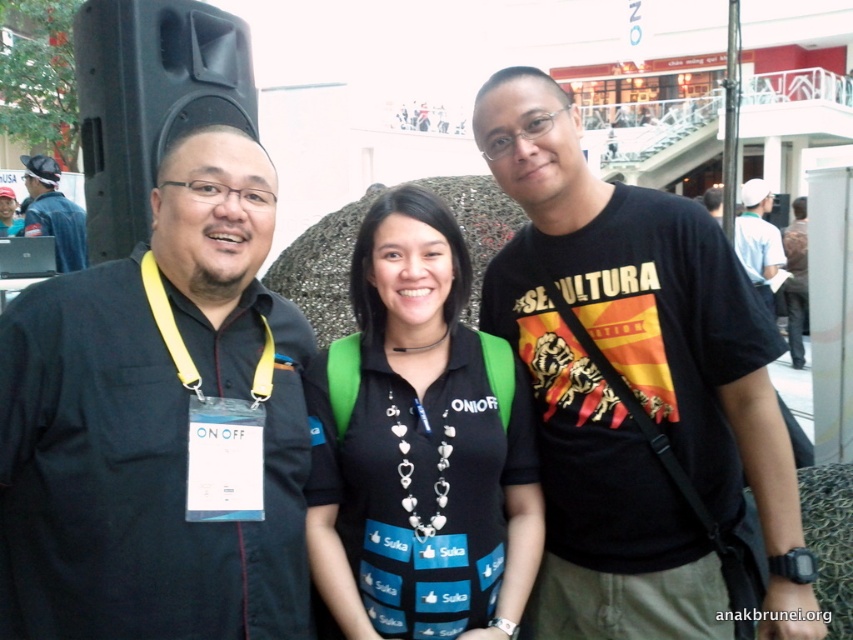
You are standing in the shopping mall and see the dark blue shirt at left and the yellow fabric lanyard at left. Which one is taller?

The dark blue shirt at left is much taller than the yellow fabric lanyard at left.

Based on the photo, you are taking a photo of the three people in the scene. Which of the two points, point 1 at coordinates point (32, 596) or point 2 at coordinates point (755, 202), will appear larger in the photo?

Point 1 at coordinates point (32, 596) will appear larger in the photo because it is closer to the camera than point 2 at coordinates point (755, 202).

You are a photographer standing at the center of the scene. You need to move from the black matte shirt at left to the white matte cap at upper right. Is the distance between them sufficient for you to walk straight without needing to navigate around any obstacles?

The distance between the black matte shirt at left and the white matte cap at upper right is 4.73 meters, so yes, you can walk straight between them without needing to navigate around any obstacles.